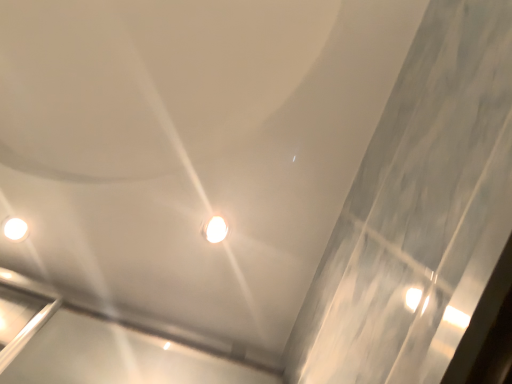
The height and width of the screenshot is (384, 512). Describe the element at coordinates (215, 229) in the screenshot. I see `white glossy droplight at center` at that location.

At what (x,y) coordinates should I click in order to perform the action: click on white glossy droplight at center. Please return your answer as a coordinate pair (x, y). Looking at the image, I should click on (215, 229).

This screenshot has width=512, height=384. I want to click on white glossy droplight at center, so click(215, 229).